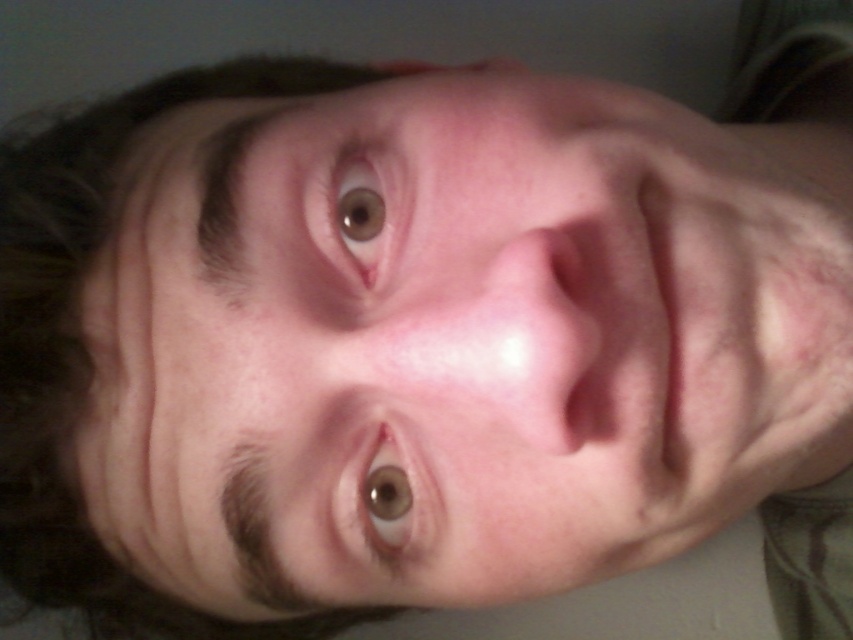
You are taking a photo of a person and want to focus on the point closer to the camera. Which point should you focus on between point (387,513) and point (402,227)?

Point (387,513) is further to the camera than point (402,227), so you should focus on point (387,513).

You are a photographer adjusting the lighting for a portrait. You notice two brown matte eyes in the frame. The brown matte eye at center and the brown matte eye at upper center. Which eye is located lower in the image?

The brown matte eye at center is positioned under the brown matte eye at upper center, so the brown matte eye at center is lower in the image.

Looking at the portrait, where is the dark brown hair at upper left in relation to the brown matte eye at upper center?

The dark brown hair at upper left is positioned to the left of the brown matte eye at upper center.